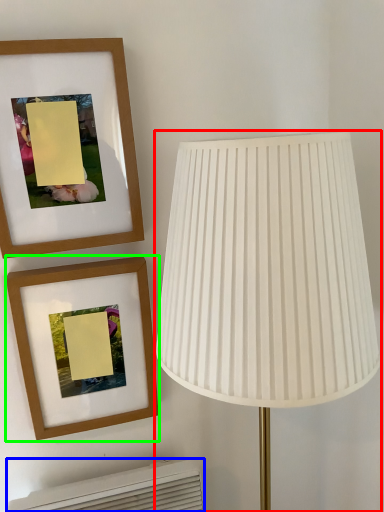
Question: Estimate the real-world distances between objects in this image. Which object is farther from lamp (highlighted by a red box), air conditioner (highlighted by a blue box) or picture frame (highlighted by a green box)?

Choices:
 (A) air conditioner
 (B) picture frame

Answer: (A)